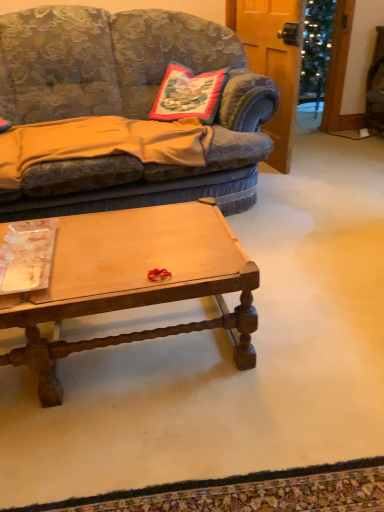
I want to click on free region under light brown wood coffee table at center (from a real-world perspective), so click(x=122, y=348).